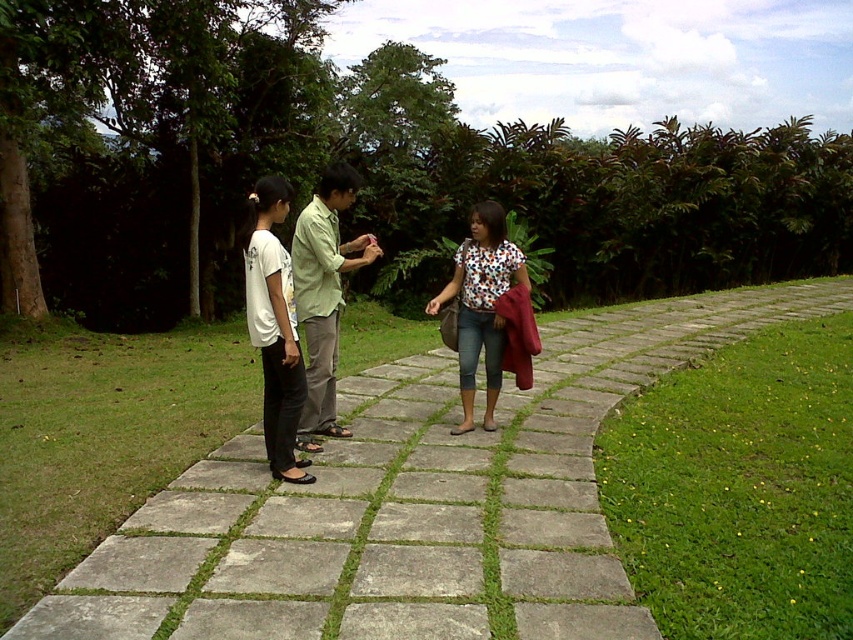
Question: Does matte green shirt at center have a lesser width compared to white matte shirt at center?

Choices:
 (A) yes
 (B) no

Answer: (B)

Question: Which object is closer to the camera taking this photo?

Choices:
 (A) white matte shirt at center
 (B) floral shirt at center

Answer: (A)

Question: Is green matte shirt at center smaller than floral shirt at center?

Choices:
 (A) yes
 (B) no

Answer: (B)

Question: Estimate the real-world distances between objects in this image. Which object is farther from the green grass at lower right?

Choices:
 (A) floral shirt at center
 (B) matte green shirt at center
 (C) green matte shirt at center

Answer: (B)

Question: Among these objects, which one is nearest to the camera?

Choices:
 (A) matte green shirt at center
 (B) green grass at lower right
 (C) floral shirt at center

Answer: (A)

Question: Does green grass at lower right have a lesser width compared to white matte shirt at center?

Choices:
 (A) no
 (B) yes

Answer: (B)